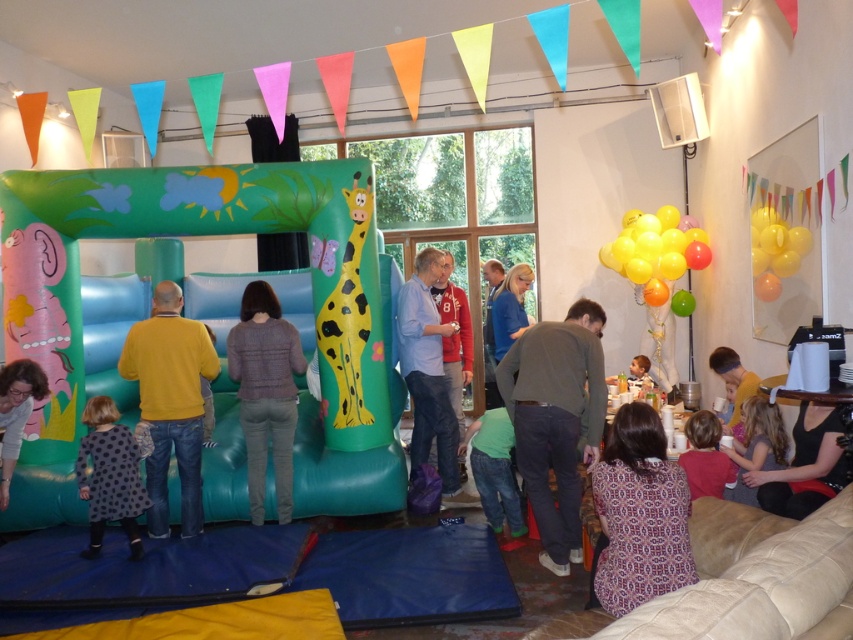
Question: Can you confirm if brown cotton shirt at center is bigger than shiny metallic balloons at upper right?

Choices:
 (A) no
 (B) yes

Answer: (A)

Question: Among these points, which one is nearest to the camera?

Choices:
 (A) (183, 461)
 (B) (241, 412)
 (C) (808, 248)
 (D) (711, 426)

Answer: (D)

Question: Which point appears farthest from the camera in this image?

Choices:
 (A) (735, 486)
 (B) (184, 332)

Answer: (B)

Question: Is knitted sweater at center wider than green matte jeans at lower center?

Choices:
 (A) no
 (B) yes

Answer: (B)

Question: Among these objects, which one is farthest from the camera?

Choices:
 (A) polka dot fabric dress at lower left
 (B) yellow matte sweater at center
 (C) brown cotton shirt at center
 (D) green matte jeans at lower center

Answer: (D)

Question: Can you confirm if shiny metallic balloons at upper right is positioned below green matte jeans at lower center?

Choices:
 (A) yes
 (B) no

Answer: (B)